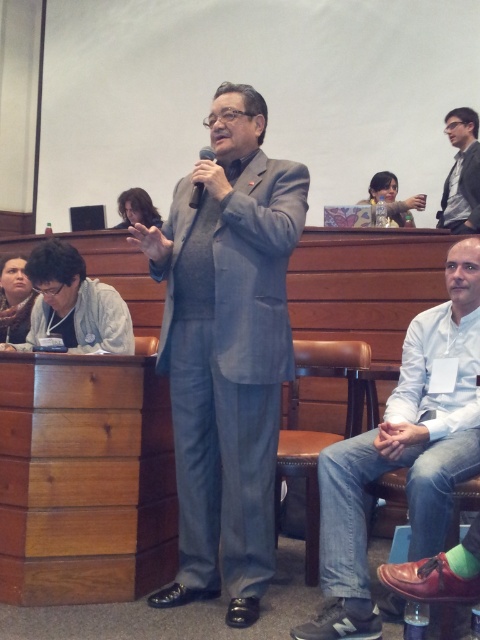
You are sitting in the audience and want to look at the presenter wearing the gray fabric suit at center. Which direction should you look relative to the matte black suit at upper right?

The gray fabric suit at center is located below the matte black suit at upper right, so you should look downward from the matte black suit at upper right to see the presenter.

You are sitting in the conference room and want to hand a note to the person wearing the white cotton shirt at lower right without disturbing the presenter holding the black matte microphone at center. Can you do this quietly?

The white cotton shirt at lower right is closer to the viewer than the black matte microphone at center, so you can likely approach them quietly without the presenter noticing since they are further away.